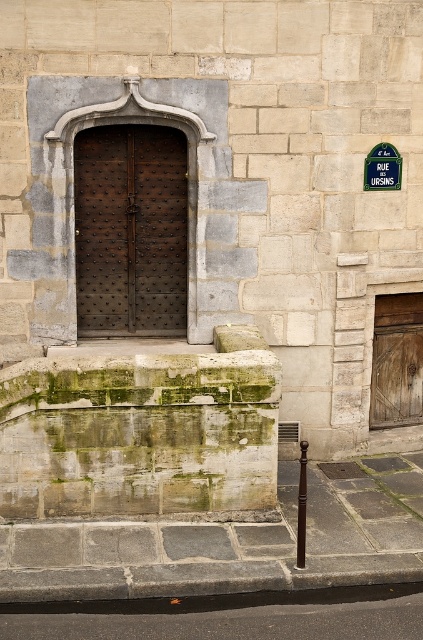
Question: Does dark brown wooden door at center appear over green plastic sign at upper right?

Choices:
 (A) no
 (B) yes

Answer: (A)

Question: Can you confirm if dark brown wooden door at center is bigger than green plastic sign at upper right?

Choices:
 (A) yes
 (B) no

Answer: (A)

Question: Is dark brown wooden door at center above green plastic sign at upper right?

Choices:
 (A) no
 (B) yes

Answer: (A)

Question: Which of the following is the closest to the observer?

Choices:
 (A) dark brown wooden door at center
 (B) green plastic sign at upper right

Answer: (A)

Question: Which of the following is the closest to the observer?

Choices:
 (A) dark brown wooden door at center
 (B) green plastic sign at upper right

Answer: (A)